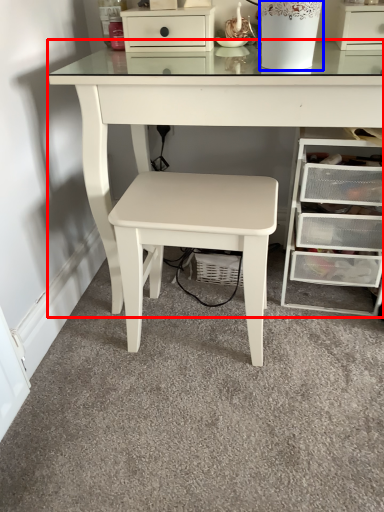
Question: Which of the following is the closest to the observer, table (highlighted by a red box) or glass vase (highlighted by a blue box)?

Choices:
 (A) table
 (B) glass vase

Answer: (A)